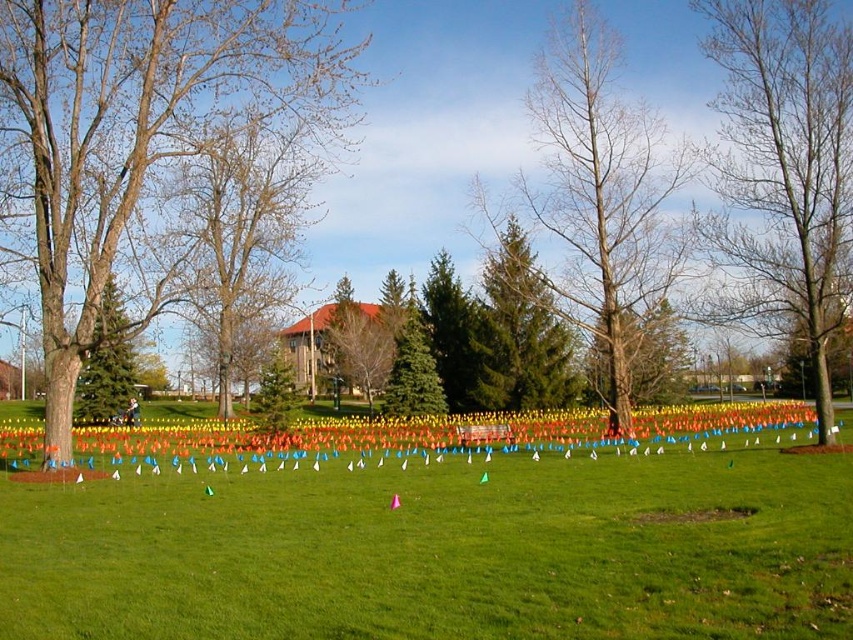
Does bare wood tree at right have a larger size compared to green matte tree at upper left?

Actually, bare wood tree at right might be smaller than green matte tree at upper left.

Is point (764, 138) positioned in front of point (120, 362)?

Yes, it is.

This screenshot has width=853, height=640. In order to click on bare wood tree at right in this screenshot , I will do `click(782, 173)`.

Does bare wood tree at center have a greater width compared to green textured evergreen tree at center?

Indeed, bare wood tree at center has a greater width compared to green textured evergreen tree at center.

Which is behind, point (616, 339) or point (486, 353)?

The point (486, 353) is more distant.

Where is `bare wood tree at center`? bare wood tree at center is located at coordinates (602, 198).

Is point (590, 346) positioned after point (230, 234)?

That is False.

Which is behind, point (567, 186) or point (224, 310)?

Point (567, 186)

Locate an element on the screen. The height and width of the screenshot is (640, 853). bare wood tree at center is located at coordinates (602, 198).